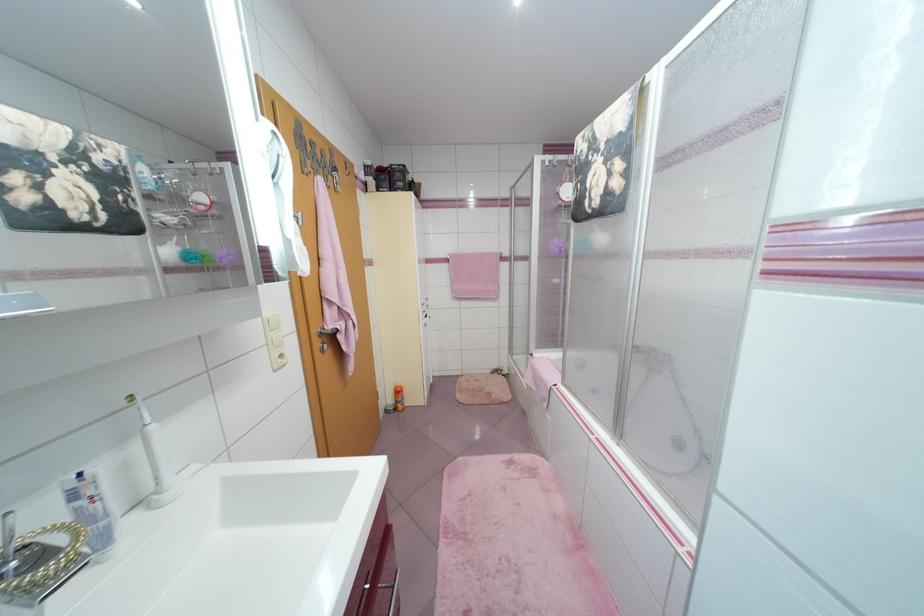
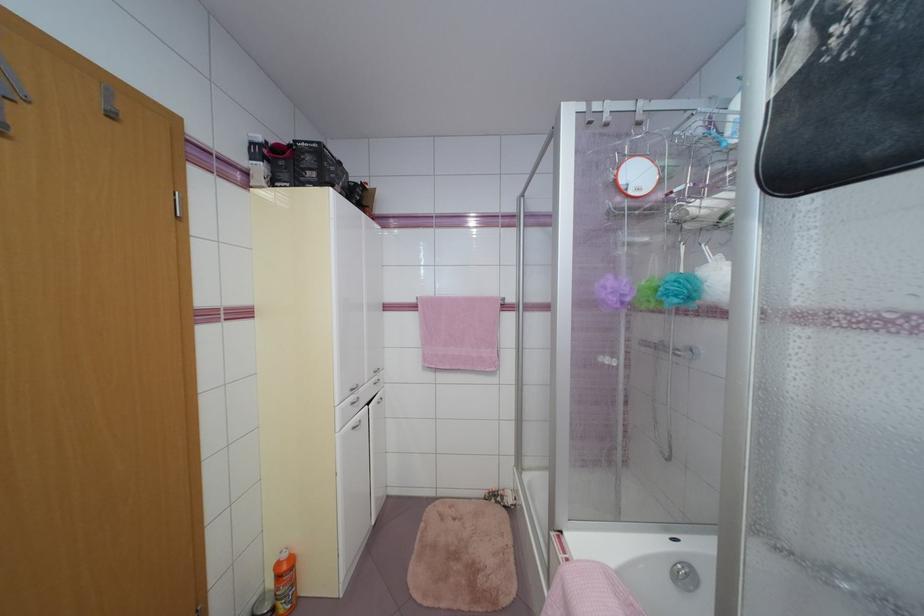
In the second image, find the point that corresponds to point 406,408 in the first image.

(287, 610)